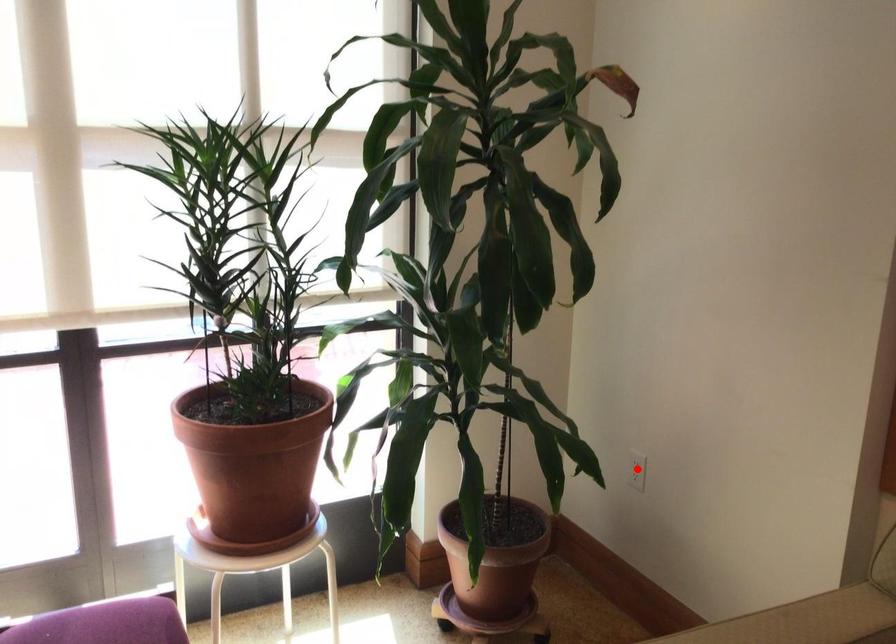
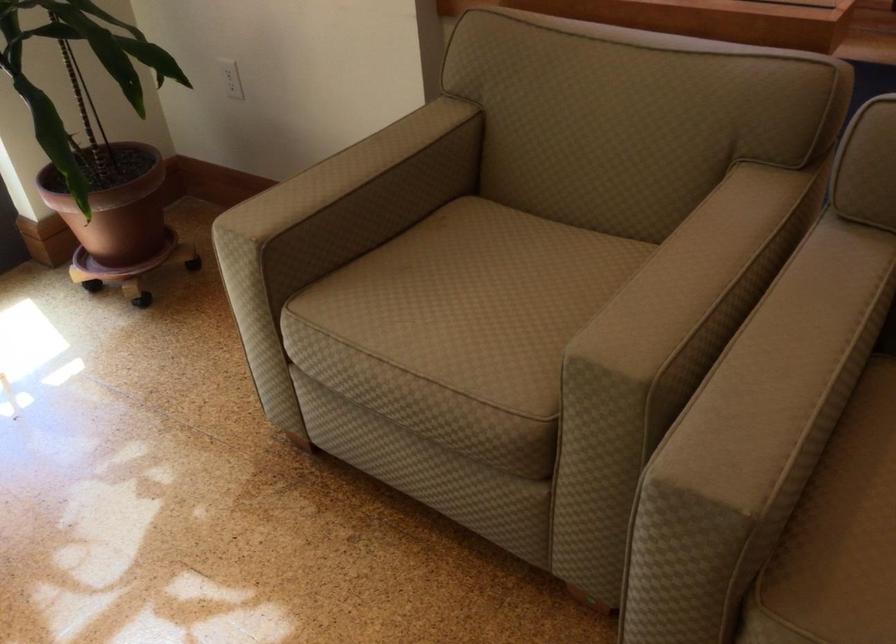
In the second image, find the point that corresponds to the highlighted location in the first image.

(231, 79)